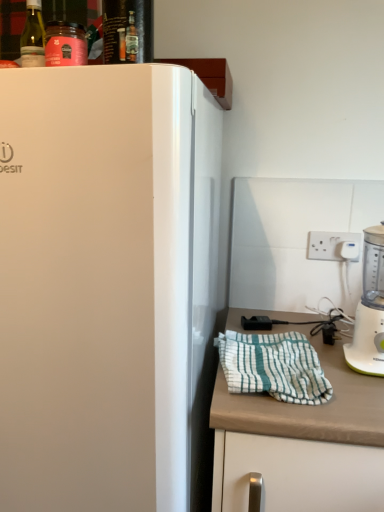
The height and width of the screenshot is (512, 384). Find the location of `white matte countertop at lower right`. white matte countertop at lower right is located at coordinates (302, 443).

In order to face white matte countertop at lower right, should I rotate leftwards or rightwards?

You should rotate right by 16.668 degrees.

This screenshot has height=512, width=384. I want to click on white striped cloth at lower right, so click(273, 366).

Image resolution: width=384 pixels, height=512 pixels. What are the coordinates of `white plastic electric outlet at upper right` in the screenshot? It's located at (334, 246).

Describe the element at coordinates (334, 246) in the screenshot. Image resolution: width=384 pixels, height=512 pixels. I see `white plastic electric outlet at upper right` at that location.

Identify the location of shiny glass bottle at upper center. (128, 31).

You are a GUI agent. You are given a task and a screenshot of the screen. Output one action in this format:
    pyautogui.click(x=<x>, y=<y>)
    Task: Click on the green glass bottle at upper left
    The height and width of the screenshot is (512, 384).
    Given the screenshot: What is the action you would take?
    pyautogui.click(x=33, y=36)

How distant is white glossy refrigerator at left from white plastic electric outlet at upper right?

29.60 inches.

Between white glossy refrigerator at left and white plastic electric outlet at upper right, which one has smaller size?

Smaller between the two is white plastic electric outlet at upper right.

From the image's perspective, which object appears higher, white glossy refrigerator at left or white plastic electric outlet at upper right?

white plastic electric outlet at upper right appears higher in the image.

Would you consider white glossy refrigerator at left to be distant from white plastic electric outlet at upper right?

That's not correct — white glossy refrigerator at left is a little close to white plastic electric outlet at upper right.

How far apart are shiny glass bottle at upper center and white plastic blender at right?

A distance of 71.87 centimeters exists between shiny glass bottle at upper center and white plastic blender at right.

Is point (124, 4) positioned after point (379, 315)?

No, (124, 4) is closer to viewer.

Is shiny glass bottle at upper center aimed at white plastic blender at right?

No, shiny glass bottle at upper center is not oriented towards white plastic blender at right.

Is shiny glass bottle at upper center positioned behind white plastic blender at right?

No, it is in front of white plastic blender at right.

Can we say white plastic electric outlet at upper right lies outside white matte countertop at lower right?

Indeed, white plastic electric outlet at upper right is completely outside white matte countertop at lower right.

Between white plastic electric outlet at upper right and white matte countertop at lower right, which one has larger width?

white matte countertop at lower right is wider.

Considering the relative positions of white plastic electric outlet at upper right and white matte countertop at lower right in the image provided, is white plastic electric outlet at upper right to the left or to the right of white matte countertop at lower right?

white plastic electric outlet at upper right is to the right of white matte countertop at lower right.

Is white plastic electric outlet at upper right in front of or behind white matte countertop at lower right in the image?

white plastic electric outlet at upper right is positioned farther from the viewer than white matte countertop at lower right.

Does point (34, 42) come behind point (376, 282)?

No, (34, 42) is in front of (376, 282).

In terms of size, does green glass bottle at upper left appear bigger or smaller than white plastic blender at right?

Considering their sizes, green glass bottle at upper left takes up less space than white plastic blender at right.

Is green glass bottle at upper left positioned with its back to white plastic blender at right?

No.

Would you say green glass bottle at upper left is outside white plastic blender at right?

Yes.

Could you tell me if white matte countertop at lower right is turned towards white plastic blender at right?

No.

Does white matte countertop at lower right have a smaller size compared to white plastic blender at right?

No, white matte countertop at lower right is not smaller than white plastic blender at right.

From a real-world perspective, is white matte countertop at lower right on white plastic blender at right?

No, from a real-world perspective, white matte countertop at lower right is not above white plastic blender at right.

Between white matte countertop at lower right and white plastic blender at right, which one has more height?

Standing taller between the two is white matte countertop at lower right.

Does white plastic blender at right have a smaller size compared to white plastic electric outlet at upper right?

Incorrect, white plastic blender at right is not smaller in size than white plastic electric outlet at upper right.

Where is `blender on the right of white plastic electric outlet at upper right`? blender on the right of white plastic electric outlet at upper right is located at coordinates tap(370, 309).

Is white plastic blender at right far away from white plastic electric outlet at upper right?

That's not correct — white plastic blender at right is a little close to white plastic electric outlet at upper right.

From the image's perspective, is white plastic blender at right under white plastic electric outlet at upper right?

Indeed, from the image's perspective, white plastic blender at right is shown beneath white plastic electric outlet at upper right.

From the image's perspective, is white plastic blender at right on green glass bottle at upper left?

No, from the image's perspective, white plastic blender at right is not above green glass bottle at upper left.

Which is in front, white plastic blender at right or green glass bottle at upper left?

green glass bottle at upper left.

Is white plastic blender at right at the right side of green glass bottle at upper left?

Yes, white plastic blender at right is to the right of green glass bottle at upper left.

Looking at their sizes, would you say white plastic blender at right is wider or thinner than green glass bottle at upper left?

white plastic blender at right is wider than green glass bottle at upper left.

Find the location of a particular element. The height and width of the screenshot is (512, 384). electric outlet on the right of white glossy refrigerator at left is located at coordinates (334, 246).

In order to click on beverage above the white plastic blender at right (from the image's perspective) in this screenshot , I will do `click(128, 31)`.

When comparing their distances from white matte countertop at lower right, does white plastic electric outlet at upper right or green glass bottle at upper left seem further?

green glass bottle at upper left is further to white matte countertop at lower right.

From the image, which object appears to be farther from white striped cloth at lower right, white matte countertop at lower right or white plastic electric outlet at upper right?

The object further to white striped cloth at lower right is white plastic electric outlet at upper right.

Based on the photo, estimate the real-world distances between objects in this image. Which object is further from shiny glass bottle at upper center, white glossy refrigerator at left or white striped cloth at lower right?

Among the two, white striped cloth at lower right is located further to shiny glass bottle at upper center.

Based on their spatial positions, is white striped cloth at lower right or shiny glass bottle at upper center further from white glossy refrigerator at left?

shiny glass bottle at upper center.

Which object lies further to the anchor point white glossy refrigerator at left, white plastic electric outlet at upper right or green glass bottle at upper left?

white plastic electric outlet at upper right lies further to white glossy refrigerator at left than the other object.

When comparing their distances from shiny glass bottle at upper center, does white glossy refrigerator at left or white plastic blender at right seem further?

white plastic blender at right is further to shiny glass bottle at upper center.

Which object lies nearer to the anchor point white striped cloth at lower right, white plastic electric outlet at upper right or green glass bottle at upper left?

white plastic electric outlet at upper right is closer to white striped cloth at lower right.

From the image, which object appears to be farther from green glass bottle at upper left, white plastic blender at right or white glossy refrigerator at left?

white plastic blender at right is positioned further to the anchor green glass bottle at upper left.

You are a GUI agent. You are given a task and a screenshot of the screen. Output one action in this format:
    pyautogui.click(x=<x>, y=<y>)
    Task: Click on the blender between shiny glass bottle at upper center and white striped cloth at lower right in the up-down direction
    
    Given the screenshot: What is the action you would take?
    pyautogui.click(x=370, y=309)

You are a GUI agent. You are given a task and a screenshot of the screen. Output one action in this format:
    pyautogui.click(x=<x>, y=<y>)
    Task: Click on the blanket situated between white glossy refrigerator at left and white plastic blender at right from left to right
    The image size is (384, 512).
    Given the screenshot: What is the action you would take?
    pyautogui.click(x=273, y=366)

Where is `electric outlet between shiny glass bottle at upper center and white matte countertop at lower right in the vertical direction`? The width and height of the screenshot is (384, 512). electric outlet between shiny glass bottle at upper center and white matte countertop at lower right in the vertical direction is located at coordinates (334, 246).

Identify the location of bottle between shiny glass bottle at upper center and white glossy refrigerator at left in the vertical direction. The image size is (384, 512). (33, 36).